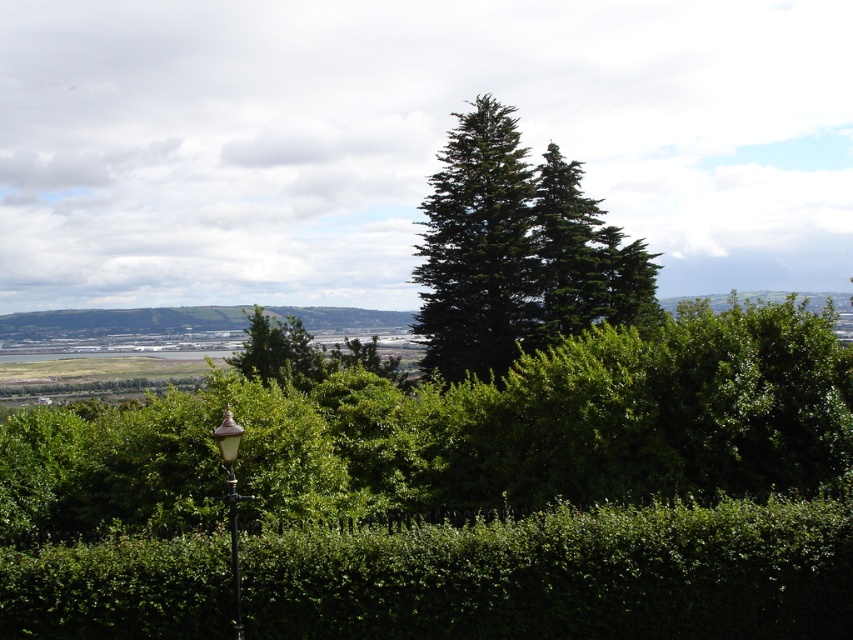
Question: Which point is closer to the camera?

Choices:
 (A) (323, 365)
 (B) (234, 513)
 (C) (477, 356)
 (D) (816, 556)

Answer: (B)

Question: Which point appears farthest from the camera in this image?

Choices:
 (A) tap(531, 337)
 (B) tap(241, 362)
 (C) tap(236, 436)
 (D) tap(550, 588)

Answer: (A)

Question: Is green leafy hedge at center below green leafy tree at center?

Choices:
 (A) no
 (B) yes

Answer: (B)

Question: Which point appears farthest from the camera in this image?

Choices:
 (A) (233, 586)
 (B) (262, 356)

Answer: (B)

Question: Is green leafy tree at center positioned behind green glass lamp post at lower left?

Choices:
 (A) no
 (B) yes

Answer: (B)

Question: Is green leafy tree at center in front of metallic pole at lower left?

Choices:
 (A) yes
 (B) no

Answer: (B)